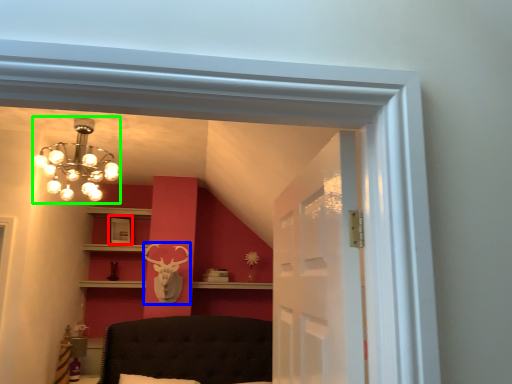
Question: Estimate the real-world distances between objects in this image. Which object is farther from picture frame (highlighted by a red box), deer (highlighted by a blue box) or lamp (highlighted by a green box)?

Choices:
 (A) deer
 (B) lamp

Answer: (B)